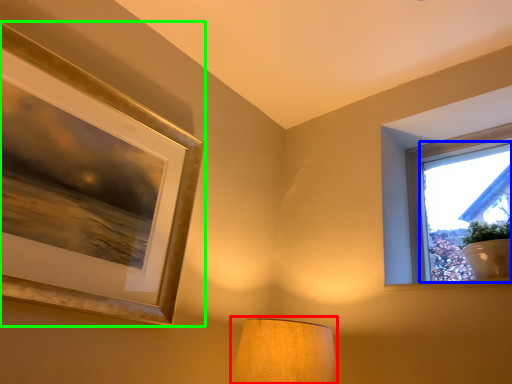
Question: Considering the real-world distances, which object is farthest from lamp (highlighted by a red box)? window screen (highlighted by a blue box) or picture frame (highlighted by a green box)?

Choices:
 (A) window screen
 (B) picture frame

Answer: (A)